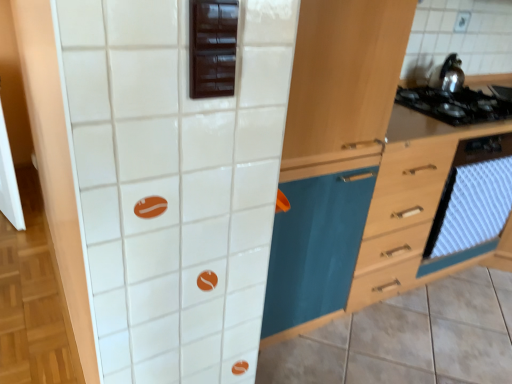
Question: Looking at their shapes, would you say dark brown wooden cabinet at upper center is wider or thinner than shiny metallic kettle at upper right?

Choices:
 (A) thin
 (B) wide

Answer: (A)

Question: From the image's perspective, is dark brown wooden cabinet at upper center positioned above or below shiny metallic kettle at upper right?

Choices:
 (A) below
 (B) above

Answer: (A)

Question: Which object is positioned closest to the black glass stove at upper right?

Choices:
 (A) wooden cabinet at center
 (B) white textured oven at right
 (C) wooden drawer at right
 (D) shiny metallic kettle at upper right
 (E) dark brown wooden cabinet at upper center

Answer: (C)

Question: Estimate the real-world distances between objects in this image. Which object is farther from the wooden drawer at right?

Choices:
 (A) black glass stove at upper right
 (B) shiny metallic kettle at upper right
 (C) dark brown wooden cabinet at upper center
 (D) wooden cabinet at center
 (E) white textured oven at right

Answer: (C)